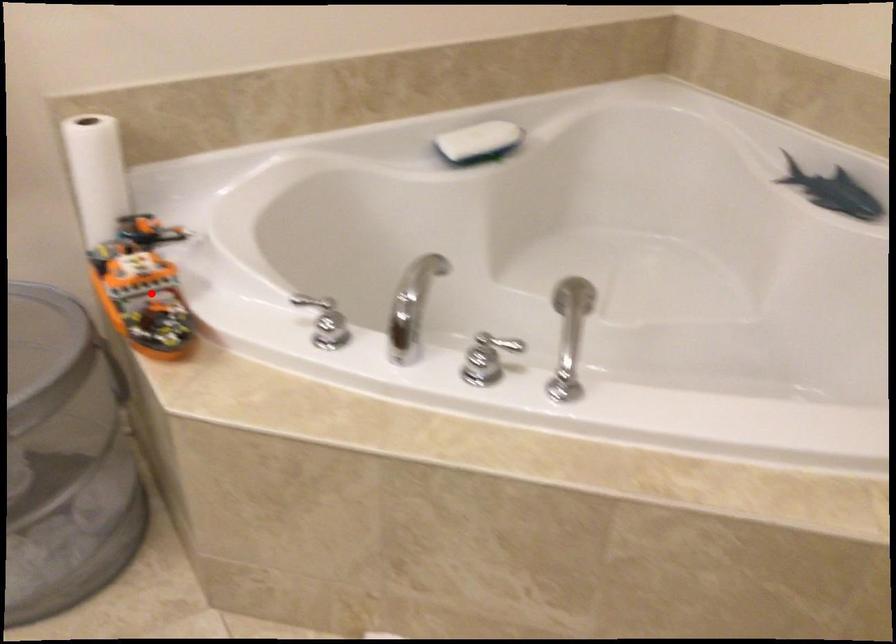
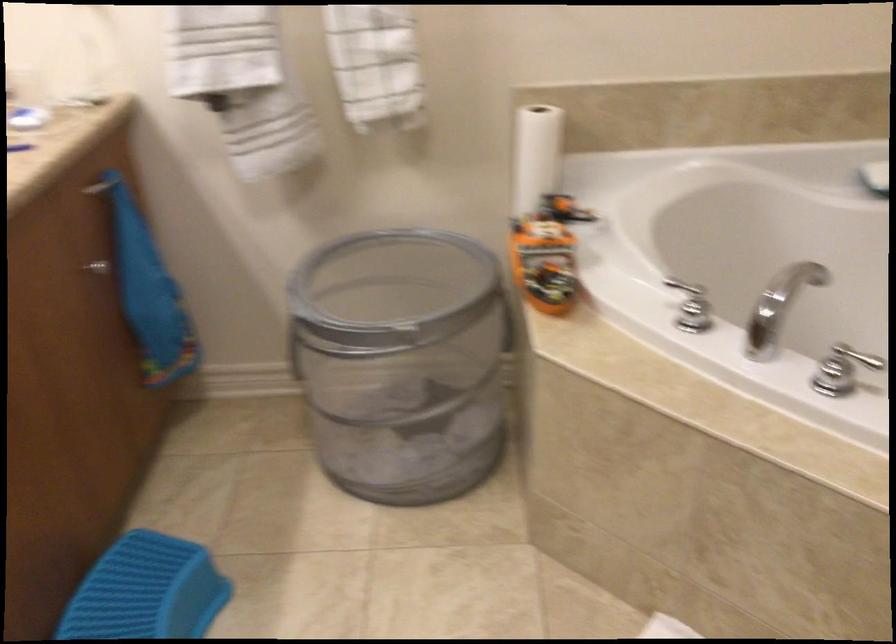
Question: I am providing you with two images of the same scene from different viewpoints. A red point is shown in image1. For the corresponding object point in image2, is it positioned nearer or farther from the camera?

Choices:
 (A) Nearer
 (B) Farther

Answer: (B)